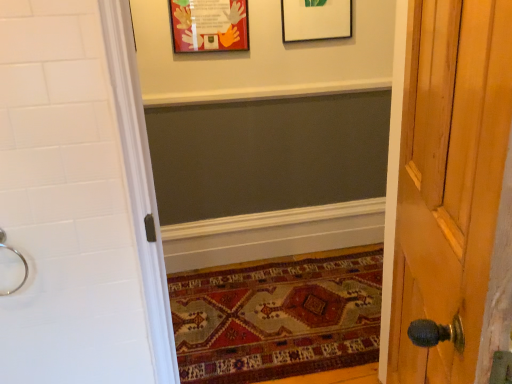
Describe the element at coordinates (316, 20) in the screenshot. I see `white matte picture frame at upper center, which is the second picture frame from left to right` at that location.

What is the approximate width of carpeted mat at lower center?

It is 37.09 inches.

The image size is (512, 384). Identify the location of white matte picture frame at upper center, which ranks as the 1th picture frame in right-to-left order. (316, 20).

Who is shorter, white matte picture frame at upper center, which ranks as the 1th picture frame in right-to-left order, or silver metallic ring at left?

silver metallic ring at left.

Does white matte picture frame at upper center, which ranks as the 1th picture frame in right-to-left order, have a lesser width compared to silver metallic ring at left?

Indeed, white matte picture frame at upper center, which ranks as the 1th picture frame in right-to-left order, has a lesser width compared to silver metallic ring at left.

Considering the points (291, 29) and (17, 250), which point is behind, point (291, 29) or point (17, 250)?

The point (291, 29) is more distant.

From the image's perspective, which is below, carpeted mat at lower center or matte cardboard picture frame at upper center, acting as the second picture frame starting from the right?

carpeted mat at lower center is shown below in the image.

Does carpeted mat at lower center have a lesser width compared to matte cardboard picture frame at upper center, the first picture frame positioned from the left?

No, carpeted mat at lower center is not thinner than matte cardboard picture frame at upper center, the first picture frame positioned from the left.

From a real-world perspective, is carpeted mat at lower center located beneath matte cardboard picture frame at upper center, acting as the second picture frame starting from the right?

Correct, in the physical world, carpeted mat at lower center is lower than matte cardboard picture frame at upper center, acting as the second picture frame starting from the right.

Based on their positions, is carpeted mat at lower center located to the left or right of matte cardboard picture frame at upper center, the first picture frame positioned from the left?

In the image, carpeted mat at lower center appears on the right side of matte cardboard picture frame at upper center, the first picture frame positioned from the left.

Considering the relative positions of silver metallic ring at left and matte cardboard picture frame at upper center, acting as the second picture frame starting from the right, in the image provided, is silver metallic ring at left to the left or to the right of matte cardboard picture frame at upper center, acting as the second picture frame starting from the right,?

Based on their positions, silver metallic ring at left is located to the left of matte cardboard picture frame at upper center, acting as the second picture frame starting from the right.

Considering their positions, is silver metallic ring at left located in front of or behind matte cardboard picture frame at upper center, the first picture frame positioned from the left?

Clearly, silver metallic ring at left is in front of matte cardboard picture frame at upper center, the first picture frame positioned from the left.

Between point (21, 254) and point (244, 10), which one is positioned behind?

The point (244, 10) is farther from the camera.

From a real-world perspective, is silver metallic ring at left on top of matte cardboard picture frame at upper center, the first picture frame positioned from the left?

Actually, silver metallic ring at left is physically below matte cardboard picture frame at upper center, the first picture frame positioned from the left, in the real world.

Between white matte picture frame at upper center, which ranks as the 1th picture frame in right-to-left order, and carpeted mat at lower center, which one has smaller width?

Thinner between the two is white matte picture frame at upper center, which ranks as the 1th picture frame in right-to-left order.

Where is `mat on the left of white matte picture frame at upper center, which ranks as the 1th picture frame in right-to-left order`? The image size is (512, 384). mat on the left of white matte picture frame at upper center, which ranks as the 1th picture frame in right-to-left order is located at coordinates (278, 316).

Looking at this image, who is bigger, white matte picture frame at upper center, which ranks as the 1th picture frame in right-to-left order, or carpeted mat at lower center?

carpeted mat at lower center is bigger.

Which point is more distant from viewer, (313,3) or (378,299)?

The point (313,3) is farther.

Would you consider white matte picture frame at upper center, which is the second picture frame from left to right, to be distant from matte cardboard picture frame at upper center, the first picture frame positioned from the left?

white matte picture frame at upper center, which is the second picture frame from left to right, is actually quite close to matte cardboard picture frame at upper center, the first picture frame positioned from the left.

From a real-world perspective, is white matte picture frame at upper center, which is the second picture frame from left to right, under matte cardboard picture frame at upper center, acting as the second picture frame starting from the right?

No, from a real-world perspective, white matte picture frame at upper center, which is the second picture frame from left to right, is not under matte cardboard picture frame at upper center, acting as the second picture frame starting from the right.

Is white matte picture frame at upper center, which ranks as the 1th picture frame in right-to-left order, oriented towards matte cardboard picture frame at upper center, acting as the second picture frame starting from the right?

No, white matte picture frame at upper center, which ranks as the 1th picture frame in right-to-left order, is not oriented towards matte cardboard picture frame at upper center, acting as the second picture frame starting from the right.

Between carpeted mat at lower center and silver metallic ring at left, which one appears on the right side from the viewer's perspective?

carpeted mat at lower center is more to the right.

What's the angular difference between carpeted mat at lower center and silver metallic ring at left's facing directions?

The angular difference between carpeted mat at lower center and silver metallic ring at left is 2.96 degrees.

From their relative heights in the image, would you say carpeted mat at lower center is taller or shorter than silver metallic ring at left?

carpeted mat at lower center is shorter than silver metallic ring at left.

From the image's perspective, which is below, carpeted mat at lower center or silver metallic ring at left?

carpeted mat at lower center appears lower in the image.

Between carpeted mat at lower center and white matte picture frame at upper center, which ranks as the 1th picture frame in right-to-left order, which one has less height?

With less height is carpeted mat at lower center.

Locate an element on the screen. mat that appears in front of the white matte picture frame at upper center, which is the second picture frame from left to right is located at coordinates (278, 316).

Can you confirm if carpeted mat at lower center is thinner than white matte picture frame at upper center, which is the second picture frame from left to right?

In fact, carpeted mat at lower center might be wider than white matte picture frame at upper center, which is the second picture frame from left to right.

I want to click on door handle below the white matte picture frame at upper center, which is the second picture frame from left to right (from a real-world perspective), so click(18, 256).

Where is `mat in front of the matte cardboard picture frame at upper center, the first picture frame positioned from the left`? mat in front of the matte cardboard picture frame at upper center, the first picture frame positioned from the left is located at coordinates (278, 316).

When comparing their distances from silver metallic ring at left, does white matte picture frame at upper center, which is the second picture frame from left to right, or carpeted mat at lower center seem further?

The object further to silver metallic ring at left is white matte picture frame at upper center, which is the second picture frame from left to right.

Considering their positions, is matte cardboard picture frame at upper center, acting as the second picture frame starting from the right, positioned closer to white matte picture frame at upper center, which ranks as the 1th picture frame in right-to-left order, than carpeted mat at lower center?

The object closer to white matte picture frame at upper center, which ranks as the 1th picture frame in right-to-left order, is matte cardboard picture frame at upper center, acting as the second picture frame starting from the right.

From the picture: From the image, which object appears to be farther from matte cardboard picture frame at upper center, acting as the second picture frame starting from the right, white matte picture frame at upper center, which is the second picture frame from left to right, or carpeted mat at lower center?

carpeted mat at lower center.

When comparing their distances from silver metallic ring at left, does carpeted mat at lower center or white matte picture frame at upper center, which ranks as the 1th picture frame in right-to-left order, seem further?

Among the two, white matte picture frame at upper center, which ranks as the 1th picture frame in right-to-left order, is located further to silver metallic ring at left.

From the picture: Estimate the real-world distances between objects in this image. Which object is further from matte cardboard picture frame at upper center, the first picture frame positioned from the left, white matte picture frame at upper center, which ranks as the 1th picture frame in right-to-left order, or silver metallic ring at left?

silver metallic ring at left is positioned further to the anchor matte cardboard picture frame at upper center, the first picture frame positioned from the left.

Based on their spatial positions, is silver metallic ring at left or carpeted mat at lower center closer to white matte picture frame at upper center, which ranks as the 1th picture frame in right-to-left order?

Based on the image, carpeted mat at lower center appears to be nearer to white matte picture frame at upper center, which ranks as the 1th picture frame in right-to-left order.

When comparing their distances from white matte picture frame at upper center, which ranks as the 1th picture frame in right-to-left order, does carpeted mat at lower center or matte cardboard picture frame at upper center, acting as the second picture frame starting from the right, seem closer?

matte cardboard picture frame at upper center, acting as the second picture frame starting from the right, is positioned closer to the anchor white matte picture frame at upper center, which ranks as the 1th picture frame in right-to-left order.

Based on their spatial positions, is silver metallic ring at left or matte cardboard picture frame at upper center, the first picture frame positioned from the left, closer to white matte picture frame at upper center, which is the second picture frame from left to right?

Based on the image, matte cardboard picture frame at upper center, the first picture frame positioned from the left, appears to be nearer to white matte picture frame at upper center, which is the second picture frame from left to right.

Identify the location of door handle between white matte picture frame at upper center, which ranks as the 1th picture frame in right-to-left order, and carpeted mat at lower center, in the vertical direction. The height and width of the screenshot is (384, 512). (18, 256).

You are a GUI agent. You are given a task and a screenshot of the screen. Output one action in this format:
    pyautogui.click(x=<x>, y=<y>)
    Task: Click on the picture frame that lies between white matte picture frame at upper center, which ranks as the 1th picture frame in right-to-left order, and carpeted mat at lower center from top to bottom
    The width and height of the screenshot is (512, 384).
    Given the screenshot: What is the action you would take?
    pyautogui.click(x=209, y=25)

Find the location of a particular element. The image size is (512, 384). door handle that lies between matte cardboard picture frame at upper center, the first picture frame positioned from the left, and carpeted mat at lower center from top to bottom is located at coordinates (18, 256).

This screenshot has height=384, width=512. In order to click on picture frame between silver metallic ring at left and white matte picture frame at upper center, which ranks as the 1th picture frame in right-to-left order, in the front-back direction in this screenshot , I will do `click(209, 25)`.